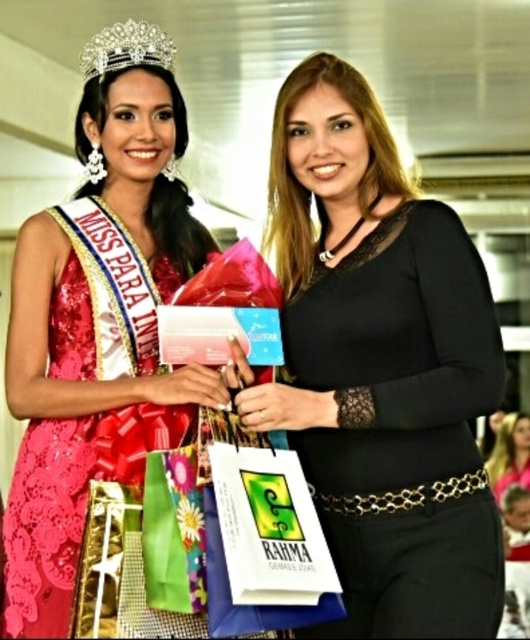
Is diamond/crystal crown at upper center above smooth black dress at center?

Correct, diamond/crystal crown at upper center is located above smooth black dress at center.

What do you see at coordinates (127, 49) in the screenshot?
I see `diamond/crystal crown at upper center` at bounding box center [127, 49].

Locate an element on the screen. diamond/crystal crown at upper center is located at coordinates [127, 49].

Consider the image. Can you confirm if shiny red dress at center is positioned above diamond/crystal crown at upper center?

No, shiny red dress at center is not above diamond/crystal crown at upper center.

Does shiny red dress at center have a larger size compared to diamond/crystal crown at upper center?

Yes, shiny red dress at center is bigger than diamond/crystal crown at upper center.

Locate an element on the screen. The image size is (530, 640). shiny red dress at center is located at coordinates (102, 365).

You are a GUI agent. You are given a task and a screenshot of the screen. Output one action in this format:
    pyautogui.click(x=<x>, y=<y>)
    Task: Click on the shiny red dress at center
    
    Given the screenshot: What is the action you would take?
    pyautogui.click(x=102, y=365)

Is black lace top at center above diamond/crystal crown at upper center?

No, black lace top at center is not above diamond/crystal crown at upper center.

Is point (343, 67) closer to viewer compared to point (95, 64)?

Yes.

Is point (477, 500) behind point (110, 65)?

That is False.

Where is `black lace top at center`? black lace top at center is located at coordinates (381, 368).